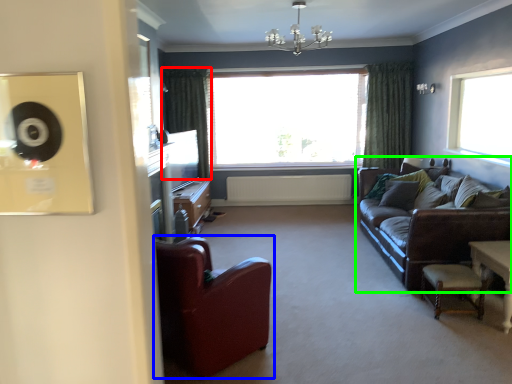
Question: Which is farther away from curtain (highlighted by a red box)? chair (highlighted by a blue box) or studio couch (highlighted by a green box)?

Choices:
 (A) chair
 (B) studio couch

Answer: (A)